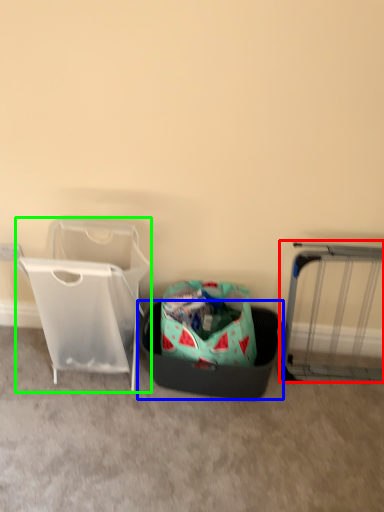
Question: Based on their relative distances, which object is farther from furniture (highlighted by a red box)? Choose from laundry basket (highlighted by a blue box) and baby carriage (highlighted by a green box).

Choices:
 (A) laundry basket
 (B) baby carriage

Answer: (B)